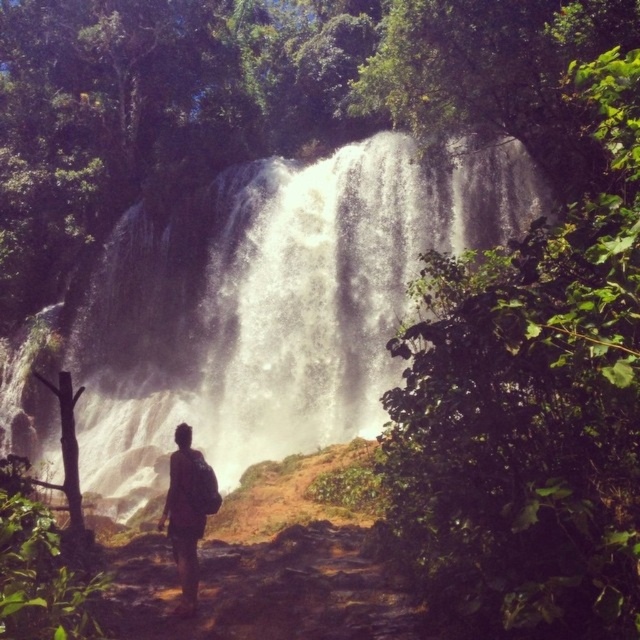
Question: Where is white frothy water at center located in relation to brown backpack at center in the image?

Choices:
 (A) above
 (B) below

Answer: (A)

Question: Does white frothy water at center appear on the right side of brown backpack at center?

Choices:
 (A) no
 (B) yes

Answer: (A)

Question: In this image, where is white frothy water at center located relative to brown backpack at center?

Choices:
 (A) left
 (B) right

Answer: (A)